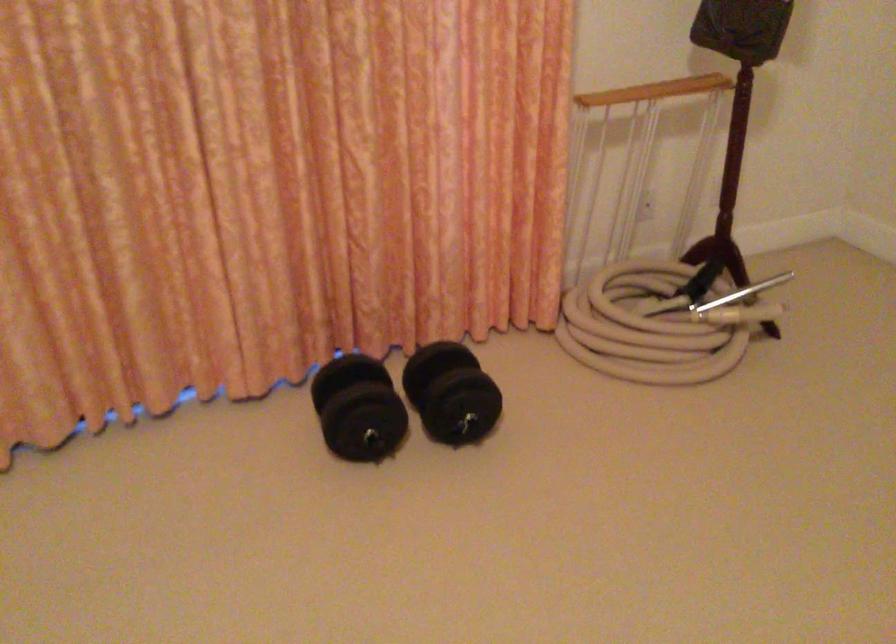
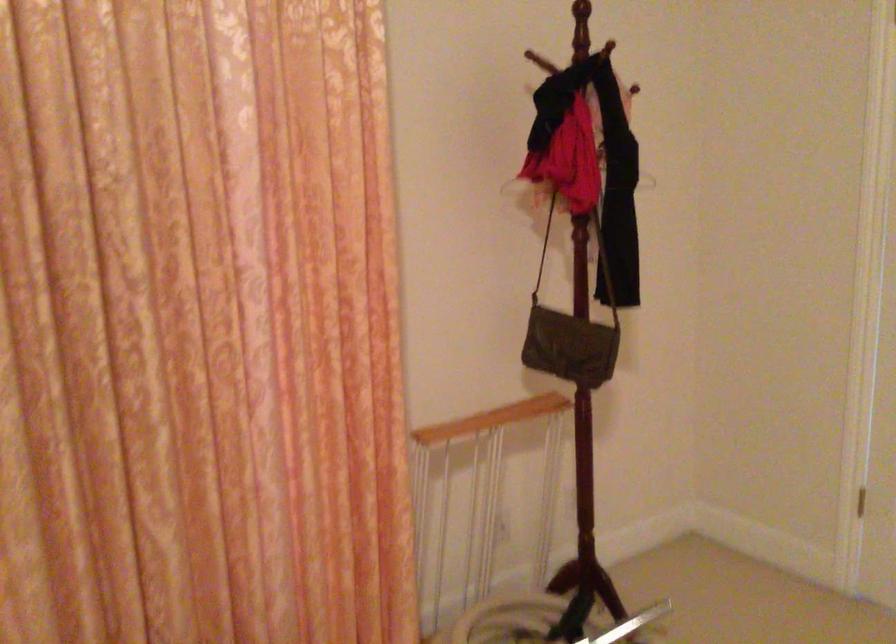
Question: How did the camera likely rotate?

Choices:
 (A) Left
 (B) Right
 (C) Up
 (D) Down

Answer: (C)